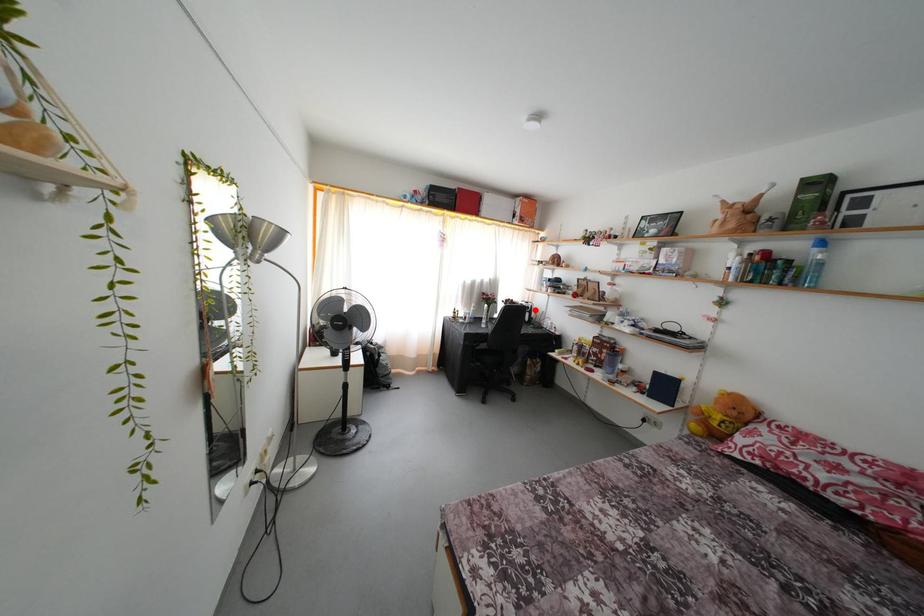
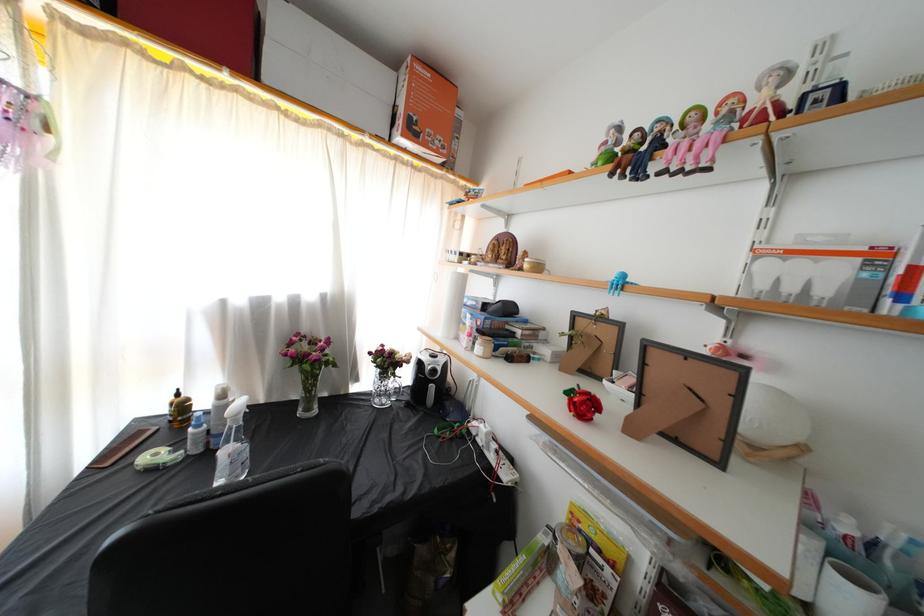
The point at the highlighted location is marked in the first image. Where is the corresponding point in the second image?

(446, 365)